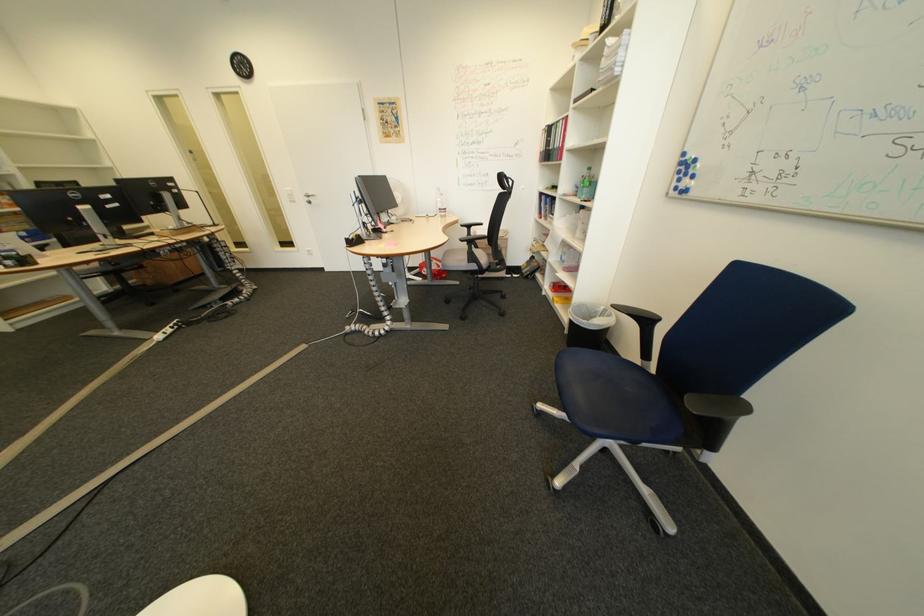
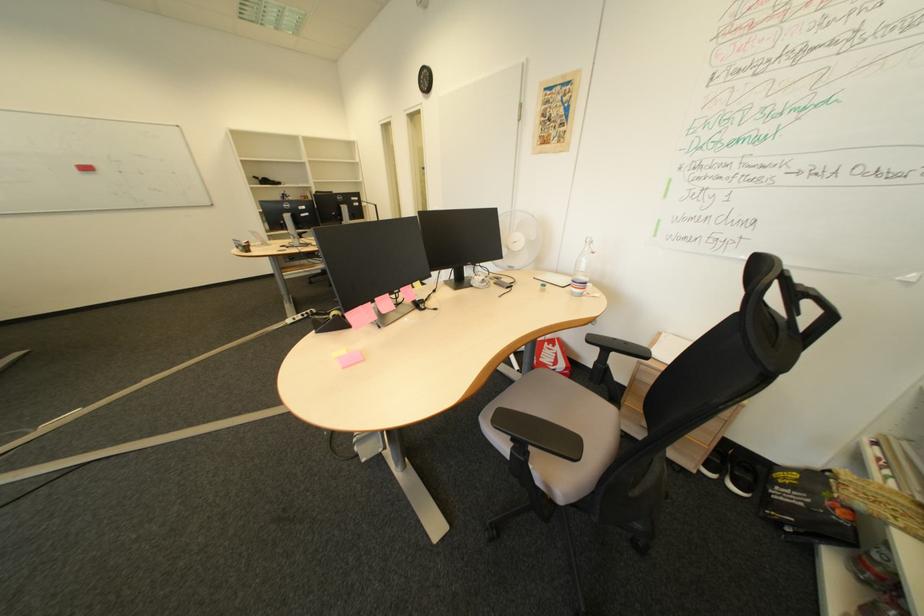
In the second image, find the point that corresponds to pixel 453 211 in the first image.

(587, 282)